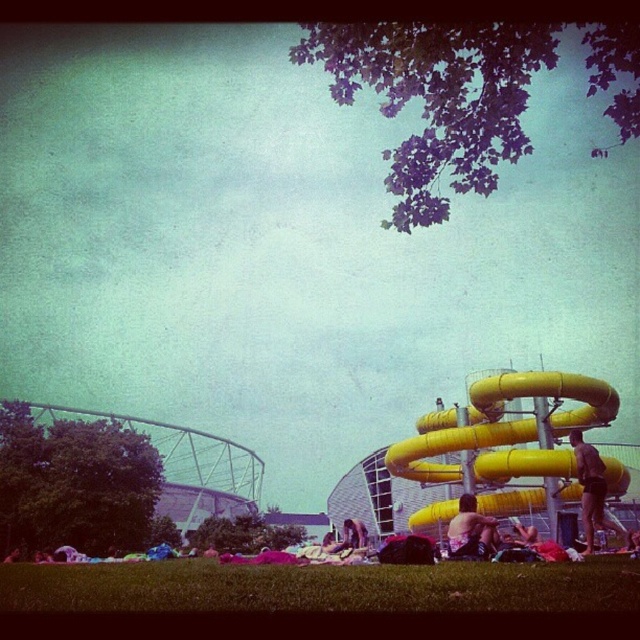
Question: Which of the following is the closest to the observer?

Choices:
 (A) yellow rubber slide at right
 (B) green grass at lower center
 (C) smooth yellow slide at right

Answer: (B)

Question: Is smooth yellow slide at right wider than matte black shorts at center?

Choices:
 (A) yes
 (B) no

Answer: (A)

Question: Is yellow rubber slide at right below smooth yellow slide at right?

Choices:
 (A) no
 (B) yes

Answer: (A)

Question: Which point appears farthest from the camera in this image?

Choices:
 (A) (467, 540)
 (B) (486, 458)
 (C) (604, 524)
 (D) (333, 580)

Answer: (C)

Question: Can you confirm if green grass at lower center is positioned to the left of matte black shorts at center?

Choices:
 (A) no
 (B) yes

Answer: (B)

Question: Which point is farther to the camera?

Choices:
 (A) yellow rubber slide at right
 (B) green grass at lower center

Answer: (A)